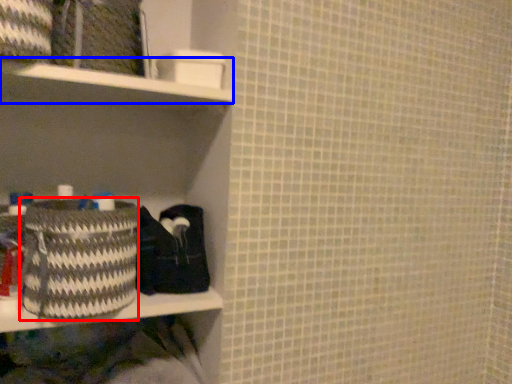
Question: Which point is further to the camera, basket (highlighted by a red box) or cabinet (highlighted by a blue box)?

Choices:
 (A) basket
 (B) cabinet

Answer: (B)